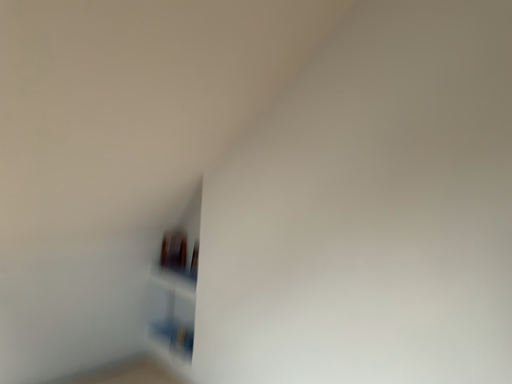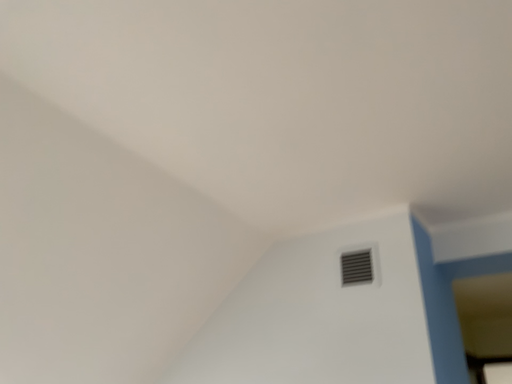
Question: Which way did the camera rotate in the video?

Choices:
 (A) rotated right
 (B) rotated left

Answer: (A)